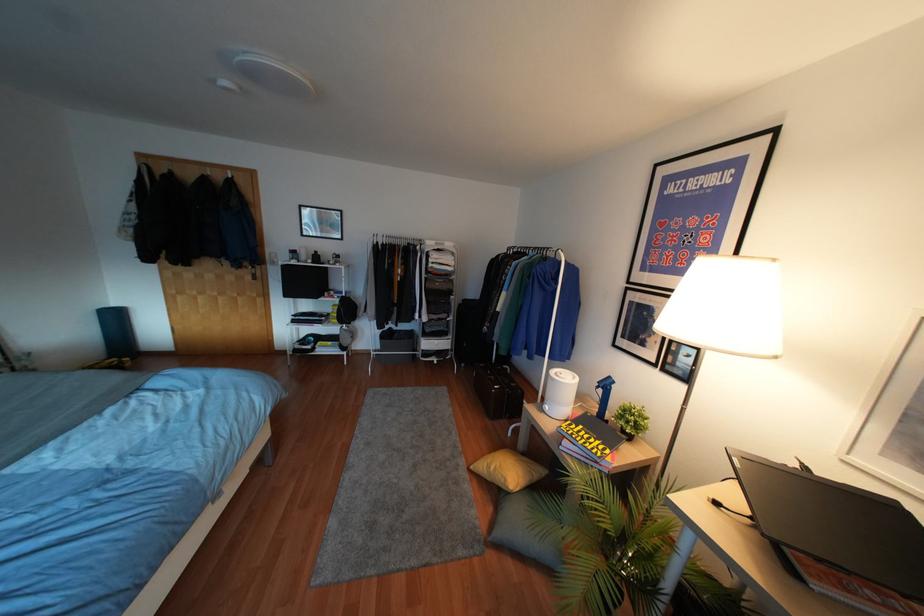
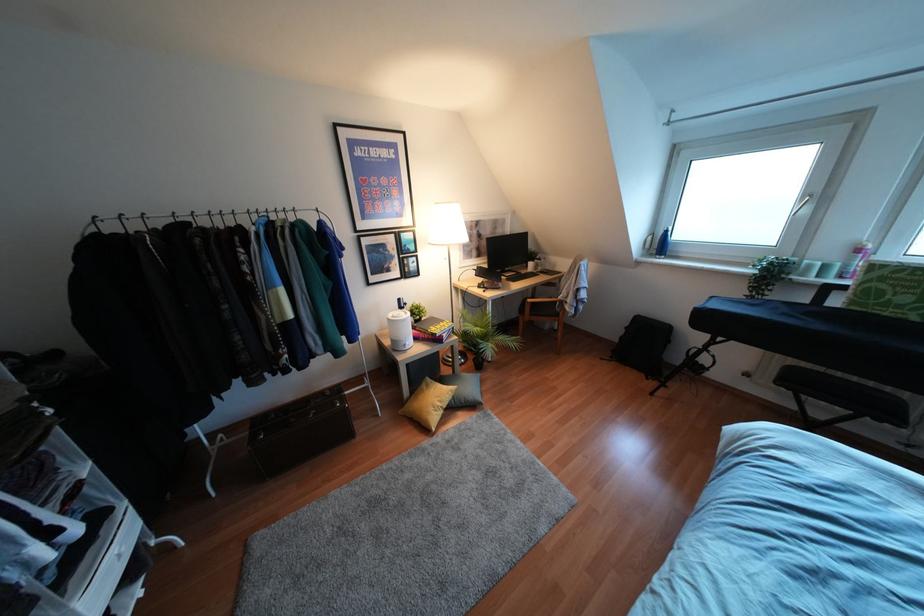
Where in the second image is the point corresponding to [492,468] from the first image?

(439, 403)